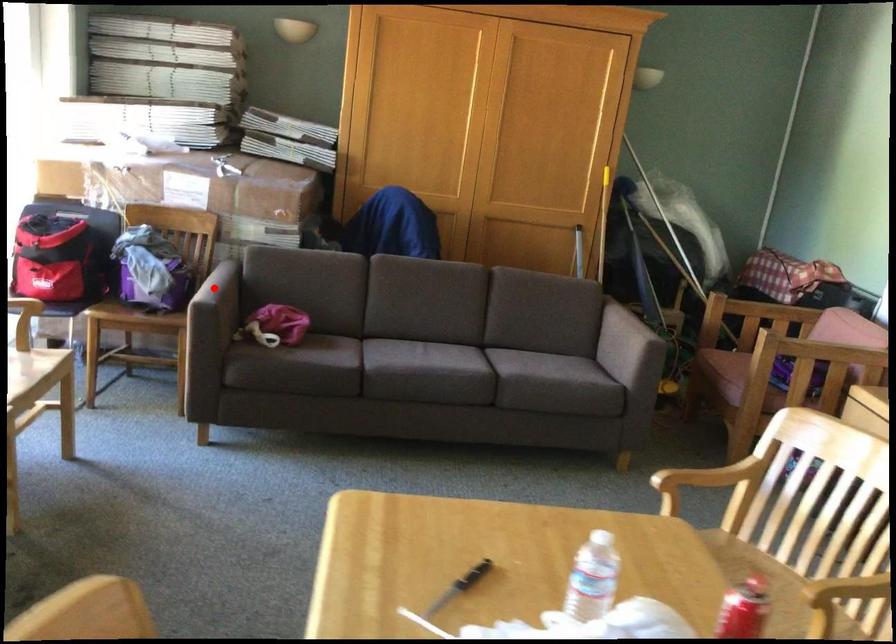
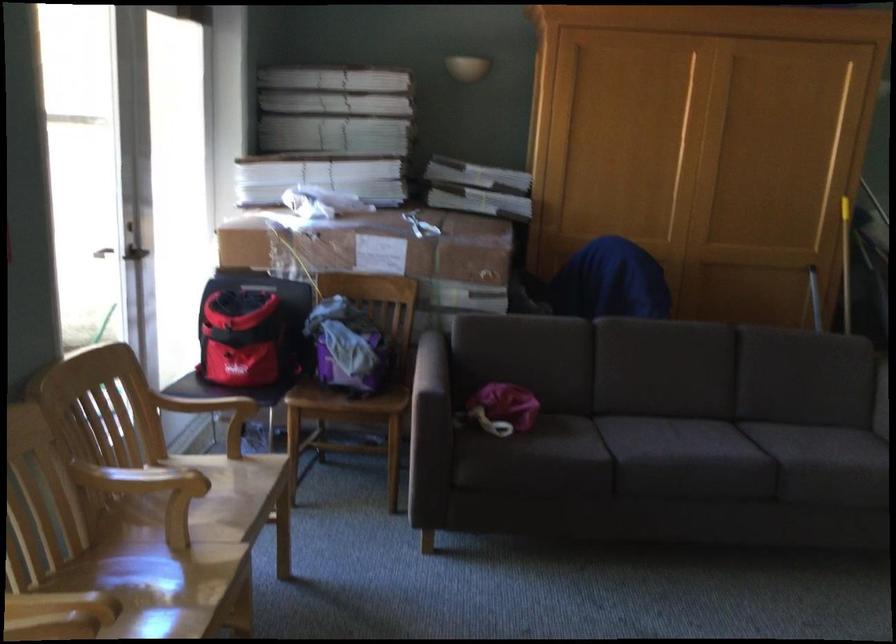
Question: A red point is marked in image1. In image2, is the corresponding 3D point closer to the camera or farther? Reply with the corresponding letter.

Choices:
 (A) The corresponding 3D point is closer.
 (B) The corresponding 3D point is farther.

Answer: (A)